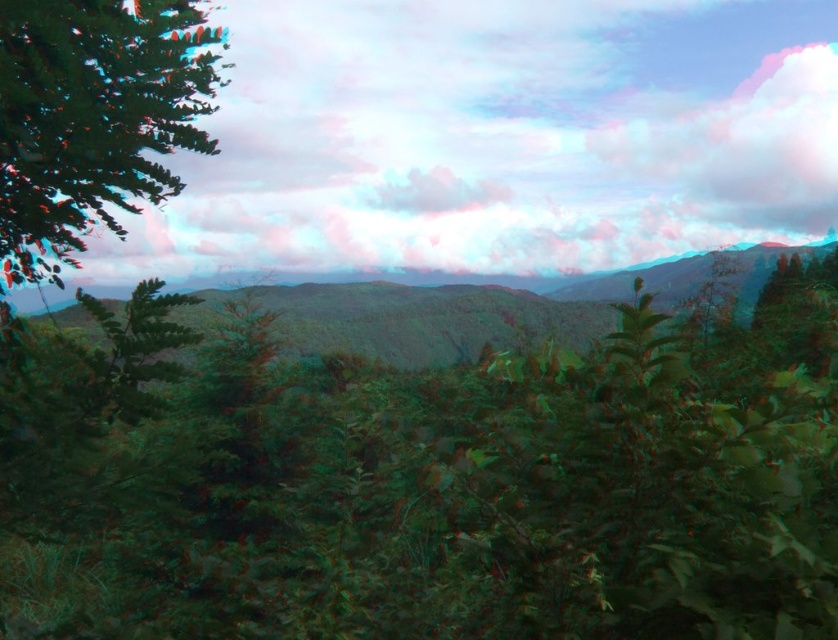
You are an artist trying to paint this landscape. You want to ensure the green matte leaves at upper left and the green leafy mountain at center are proportionally accurate. Which object should you paint smaller in your artwork?

The green matte leaves at upper left should be painted smaller than the green leafy mountain at center because the description states that the green matte leaves at upper left is not as tall as the green leafy mountain at center.